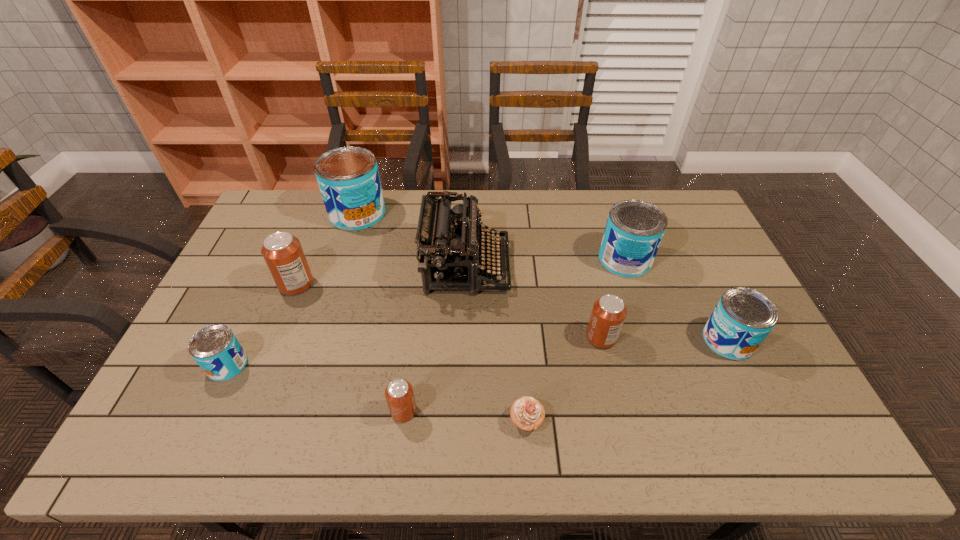
Locate an element on the screen. Image resolution: width=960 pixels, height=540 pixels. vacant space at the near edge is located at coordinates (517, 451).

In the image, there is a desktop. At what (x,y) coordinates should I click in order to perform the action: click on vacant space at the left edge. Please return your answer as a coordinate pair (x, y). The width and height of the screenshot is (960, 540). Looking at the image, I should click on (214, 314).

This screenshot has width=960, height=540. In the image, there is a desktop. Identify the location of vacant space at the right edge. (676, 237).

The width and height of the screenshot is (960, 540). What are the coordinates of `free space at the near left corner of the desktop` in the screenshot? It's located at (145, 427).

Where is `free space at the far right corner of the desktop`? The image size is (960, 540). free space at the far right corner of the desktop is located at coordinates pos(689,226).

The image size is (960, 540). Find the location of `free spot between the typewriter and the farthest orange can`. free spot between the typewriter and the farthest orange can is located at coordinates (381, 275).

This screenshot has height=540, width=960. Identify the location of free spot between the farthest blue can and the cupcake. (442, 317).

Find the location of a particular element. The width and height of the screenshot is (960, 540). vacant area that lies between the typewriter and the leftmost blue can is located at coordinates (347, 315).

Locate an element on the screen. empty space between the second biggest blue can and the nearest can is located at coordinates (515, 335).

Find the location of a particular element. vacant space that is in between the rightmost orange can and the typewriter is located at coordinates [534, 301].